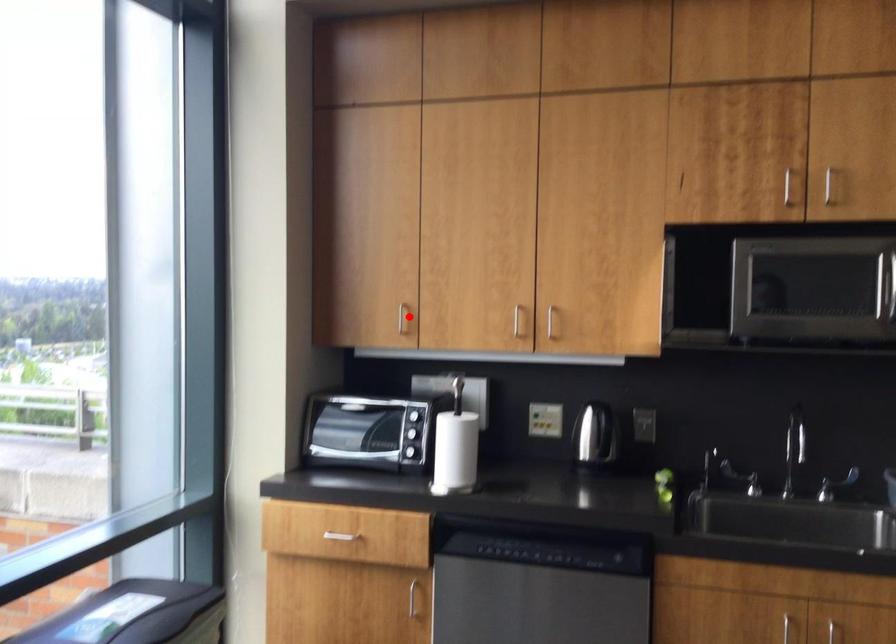
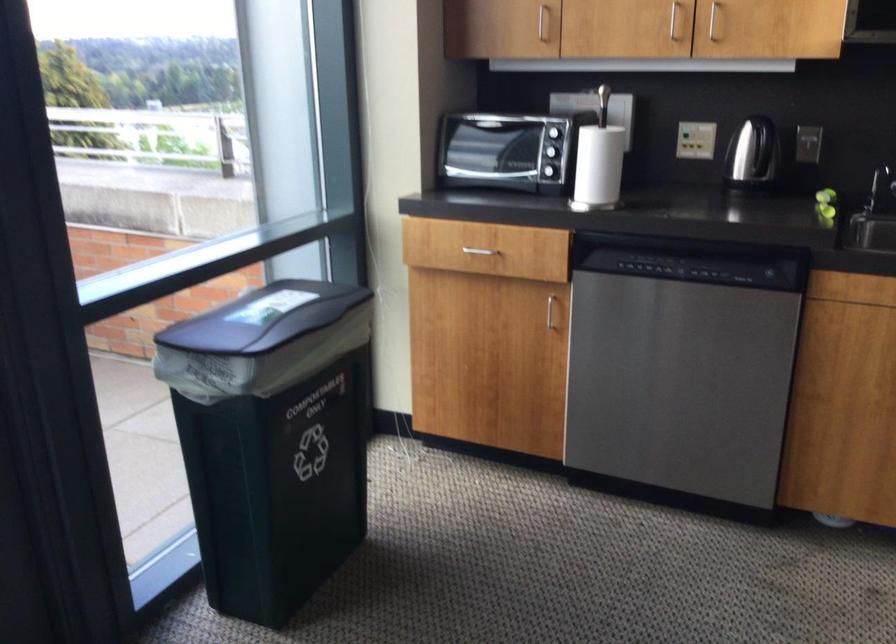
Locate, in the second image, the point that corresponds to the highlighted location in the first image.

(543, 23)